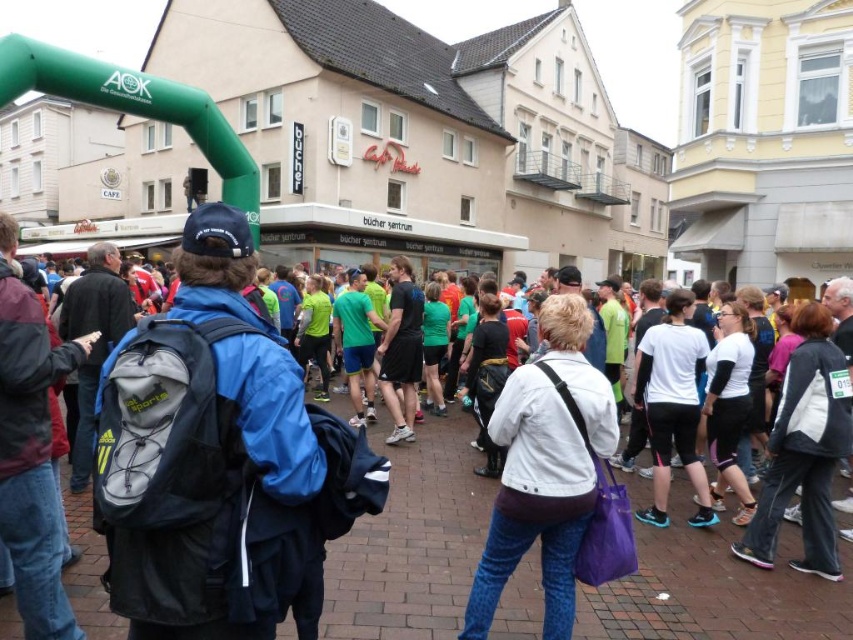
You are a photographer trying to capture both the matte gray backpack at center and the white matte jacket at center in a single frame. Based on their distance, can you fit both in your camera view without moving closer or farther?

The matte gray backpack at center and white matte jacket at center are 8.29 meters apart. Since the distance between them is quite large, you might need to adjust your camera settings or use a wider lens to ensure both are in frame without moving closer or farther.

You are a photographer standing at the center of the town square, and you want to take a photo of two points in the scene. The first point is at coordinates point (242, 237) and the second point is at point (498, 586). Which point will appear larger in your photo?

Point (242, 237) is closer to the camera than point (498, 586), so it will appear larger in the photo.

You are a photographer at the event and want to capture both the blue synthetic jacket at center and the white matte jacket at center in a single frame. Which jacket should you focus on first to ensure both are in the shot?

The blue synthetic jacket at center is located below the white matte jacket at center, so you should focus on the white matte jacket at center first to ensure both are in the shot.